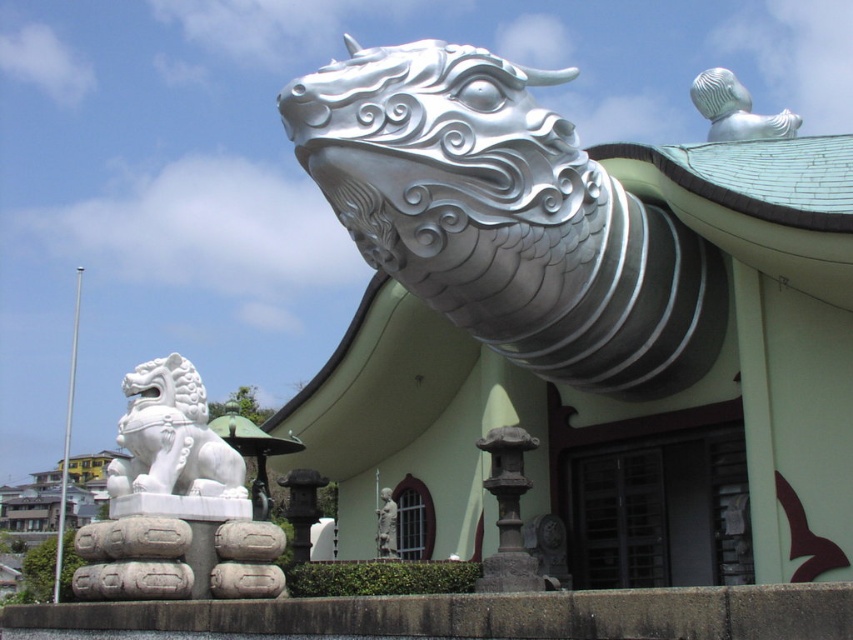
Question: Can you confirm if dark gray stone lantern at center is positioned below smooth stone lantern at center?

Choices:
 (A) no
 (B) yes

Answer: (A)

Question: Can you confirm if silver metallic statue at upper right is positioned to the left of smooth stone lantern at center?

Choices:
 (A) no
 (B) yes

Answer: (A)

Question: Estimate the real-world distances between objects in this image. Which object is farther from the smooth stone lantern at center?

Choices:
 (A) white stone lion at left
 (B) dark gray stone lantern at center
 (C) polished silver dragon head at upper right

Answer: (C)

Question: Among these points, which one is nearest to the camera?

Choices:
 (A) (440, 310)
 (B) (705, 84)
 (C) (494, 481)

Answer: (C)

Question: Is white stone lion at left above dark gray stone lantern at center?

Choices:
 (A) yes
 (B) no

Answer: (B)

Question: Which is farther from the polished silver dragon head at upper right?

Choices:
 (A) white stone lion at left
 (B) matte white statue at center
 (C) silver metallic statue at upper right

Answer: (C)